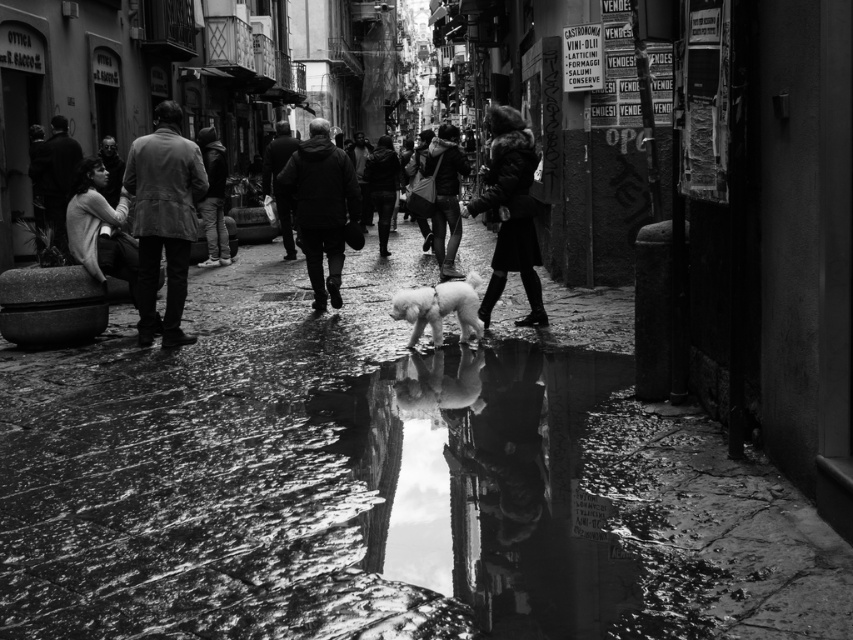
Is point (466, 330) positioned behind point (225, 256)?

No, it is not.

The width and height of the screenshot is (853, 640). I want to click on matte gray coat at center, so click(321, 209).

Does fur coat at center have a smaller size compared to dark gray jacket at center?

Yes.

I want to click on fur coat at center, so click(509, 211).

Where is `fur coat at center`? fur coat at center is located at coordinates (509, 211).

Is the position of fluffy white dog at center more distant than that of dark woolen coat at center?

No, it is not.

Between fluffy white dog at center and dark woolen coat at center, which one is positioned higher?

dark woolen coat at center is higher up.

Which is in front, point (416, 307) or point (393, 196)?

Positioned in front is point (416, 307).

I want to click on fluffy white dog at center, so click(439, 308).